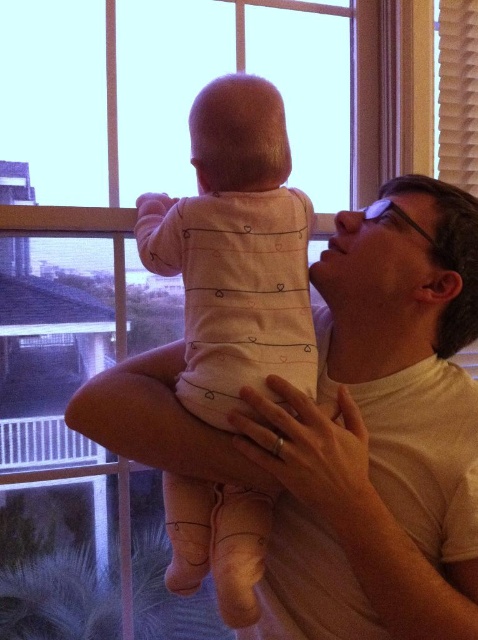
Question: Observing the image, what is the correct spatial positioning of white matte shirt at upper center in reference to pink fabric baby at center?

Choices:
 (A) left
 (B) right

Answer: (B)

Question: Among these objects, which one is farthest from the camera?

Choices:
 (A) white matte arm at center
 (B) pink fabric baby at center

Answer: (B)

Question: Is white matte arm at center to the right of pink fabric baby at center from the viewer's perspective?

Choices:
 (A) yes
 (B) no

Answer: (A)

Question: Can you confirm if white matte shirt at upper center is positioned above pink fabric baby at center?

Choices:
 (A) no
 (B) yes

Answer: (A)

Question: Which of the following is the farthest from the observer?

Choices:
 (A) pink fabric baby at center
 (B) white matte arm at center
 (C) white matte shirt at upper center

Answer: (A)

Question: Which of the following is the closest to the observer?

Choices:
 (A) (422, 568)
 (B) (221, 305)
 (C) (421, 522)

Answer: (A)